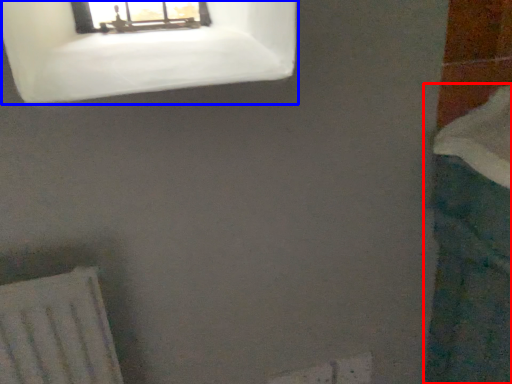
Question: Which object appears closest to the camera in this image, bath (highlighted by a red box) or window (highlighted by a blue box)?

Choices:
 (A) bath
 (B) window

Answer: (A)